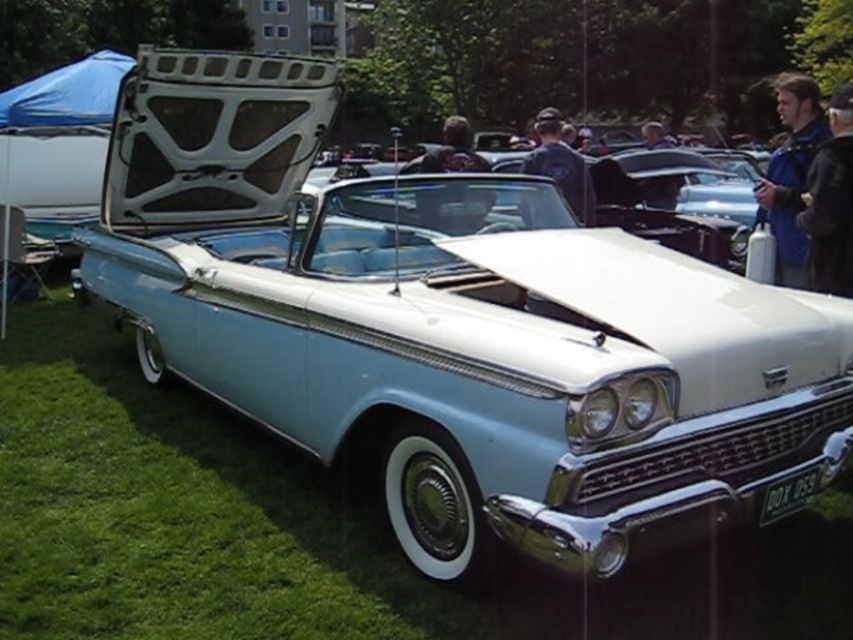
Question: Can you confirm if blue jacket at upper right is wider than dark blue jacket at upper right?

Choices:
 (A) no
 (B) yes

Answer: (B)

Question: Which object appears closest to the camera in this image?

Choices:
 (A) dark blue jacket at upper right
 (B) blue jacket at upper right
 (C) dark blue uniform at center

Answer: (A)

Question: Estimate the real-world distances between objects in this image. Which object is closer to the blue jacket at upper right?

Choices:
 (A) dark blue uniform at center
 (B) dark blue jacket at upper right

Answer: (B)

Question: Which of the following is the farthest from the observer?

Choices:
 (A) dark blue jacket at upper right
 (B) dark blue uniform at center

Answer: (B)

Question: Can you confirm if blue jacket at upper right is thinner than dark blue jacket at upper right?

Choices:
 (A) no
 (B) yes

Answer: (A)

Question: Is blue jacket at upper right below dark blue jacket at upper right?

Choices:
 (A) yes
 (B) no

Answer: (B)